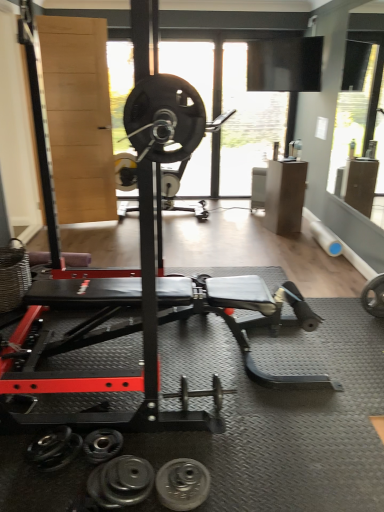
This screenshot has height=512, width=384. Find the location of `blank space above black rubber dumbbell at lower center, the 1th dumbbell from the front (from a real-world perspective)`. blank space above black rubber dumbbell at lower center, the 1th dumbbell from the front (from a real-world perspective) is located at coordinates (125, 478).